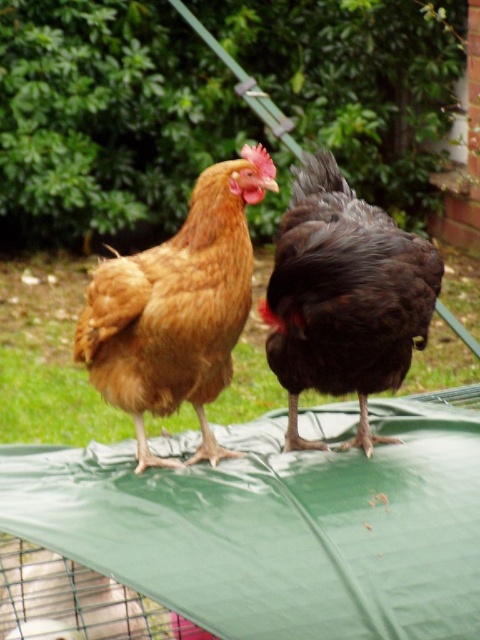
Does golden brown feathered chicken at center have a larger size compared to dark brown glossy chicken at right?

Incorrect, golden brown feathered chicken at center is not larger than dark brown glossy chicken at right.

Can you confirm if golden brown feathered chicken at center is positioned below dark brown glossy chicken at right?

Correct, golden brown feathered chicken at center is located below dark brown glossy chicken at right.

Which is behind, point (211, 332) or point (296, 252)?

The point (296, 252) is behind.

Where is `golden brown feathered chicken at center`? This screenshot has height=640, width=480. golden brown feathered chicken at center is located at coordinates (178, 307).